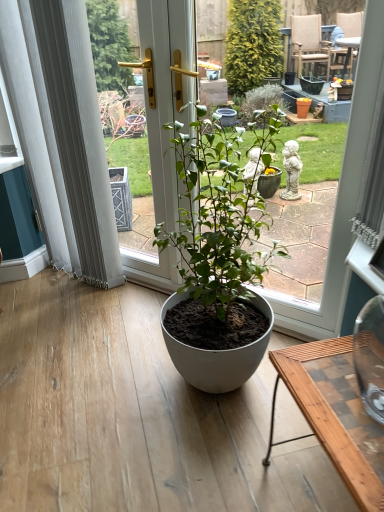
Question: Is white sheer curtain at left a part of matte white pot at center?

Choices:
 (A) no
 (B) yes

Answer: (A)

Question: Is matte white pot at center looking in the opposite direction of white sheer curtain at left?

Choices:
 (A) no
 (B) yes

Answer: (A)

Question: Is matte white pot at center oriented towards white sheer curtain at left?

Choices:
 (A) no
 (B) yes

Answer: (A)

Question: Considering the relative positions of matte white pot at center and white sheer curtain at left in the image provided, is matte white pot at center behind white sheer curtain at left?

Choices:
 (A) yes
 (B) no

Answer: (B)

Question: Is matte white pot at center to the left of white sheer curtain at left from the viewer's perspective?

Choices:
 (A) no
 (B) yes

Answer: (A)

Question: Is wooden desk at lower right wider or thinner than matte white pot at center?

Choices:
 (A) wide
 (B) thin

Answer: (A)

Question: From a real-world perspective, is wooden desk at lower right positioned above or below matte white pot at center?

Choices:
 (A) above
 (B) below

Answer: (B)

Question: From the image's perspective, relative to matte white pot at center, is wooden desk at lower right above or below?

Choices:
 (A) above
 (B) below

Answer: (B)

Question: Relative to matte white pot at center, is wooden desk at lower right in front or behind?

Choices:
 (A) behind
 (B) front

Answer: (B)

Question: Is point (301, 303) closer or farther from the camera than point (84, 179)?

Choices:
 (A) farther
 (B) closer

Answer: (B)

Question: From the image's perspective, is matte white pot at center above or below white sheer curtain at left?

Choices:
 (A) below
 (B) above

Answer: (A)

Question: From a real-world perspective, relative to white sheer curtain at left, is matte white pot at center vertically above or below?

Choices:
 (A) above
 (B) below

Answer: (B)

Question: Is matte white pot at center in front of or behind white sheer curtain at left in the image?

Choices:
 (A) behind
 (B) front

Answer: (B)

Question: Considering the positions of wooden desk at lower right and matte white pot at center in the image, is wooden desk at lower right taller or shorter than matte white pot at center?

Choices:
 (A) short
 (B) tall

Answer: (A)

Question: Considering their positions, is wooden desk at lower right located in front of or behind matte white pot at center?

Choices:
 (A) behind
 (B) front

Answer: (B)